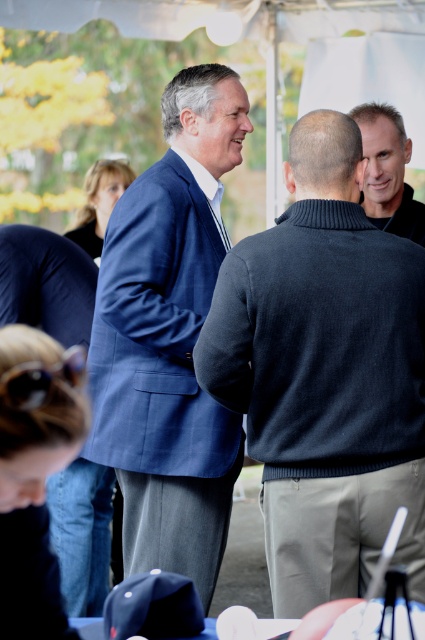
Looking at this image, is blue woolen suit at center below smooth gray sweater at upper right?

Correct, blue woolen suit at center is located below smooth gray sweater at upper right.

Image resolution: width=425 pixels, height=640 pixels. I want to click on blue woolen suit at center, so click(169, 339).

Image resolution: width=425 pixels, height=640 pixels. Find the location of `blue woolen suit at center`. blue woolen suit at center is located at coordinates (169, 339).

Does point (248, 348) lie in front of point (181, 209)?

Yes.

In the scene shown: Can you confirm if blue wool suit at center is wider than blue woolen suit at center?

Yes, blue wool suit at center is wider than blue woolen suit at center.

Is point (368, 484) positioned after point (238, 460)?

No, (368, 484) is in front of (238, 460).

Identify the location of blue wool suit at center. (325, 372).

In the scene shown: Is blue wool suit at center to the left of smooth gray sweater at upper right from the viewer's perspective?

Yes, blue wool suit at center is to the left of smooth gray sweater at upper right.

Which is in front, point (405, 563) or point (394, 154)?

Point (405, 563) is more forward.

Find the location of a particular element. Image resolution: width=425 pixels, height=640 pixels. blue wool suit at center is located at coordinates (325, 372).